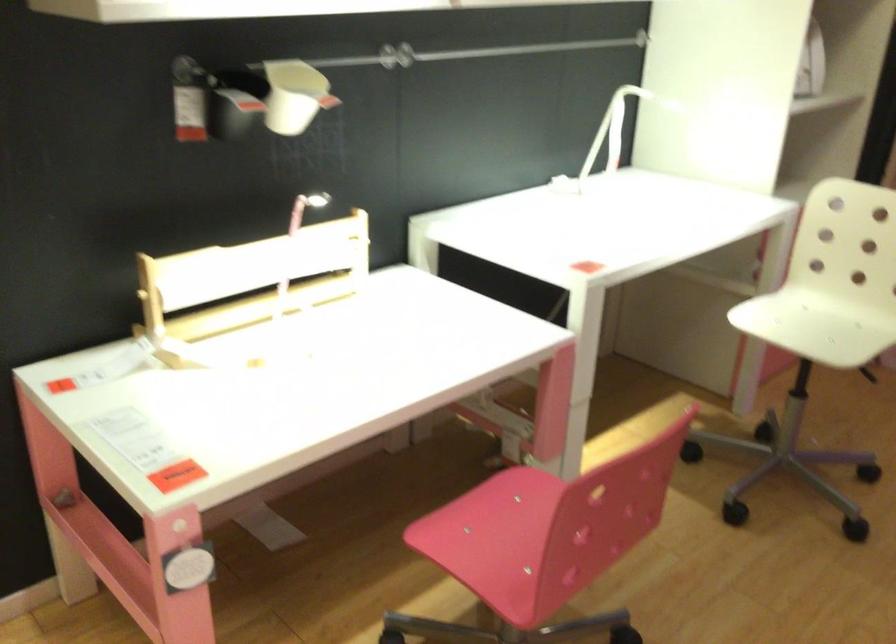
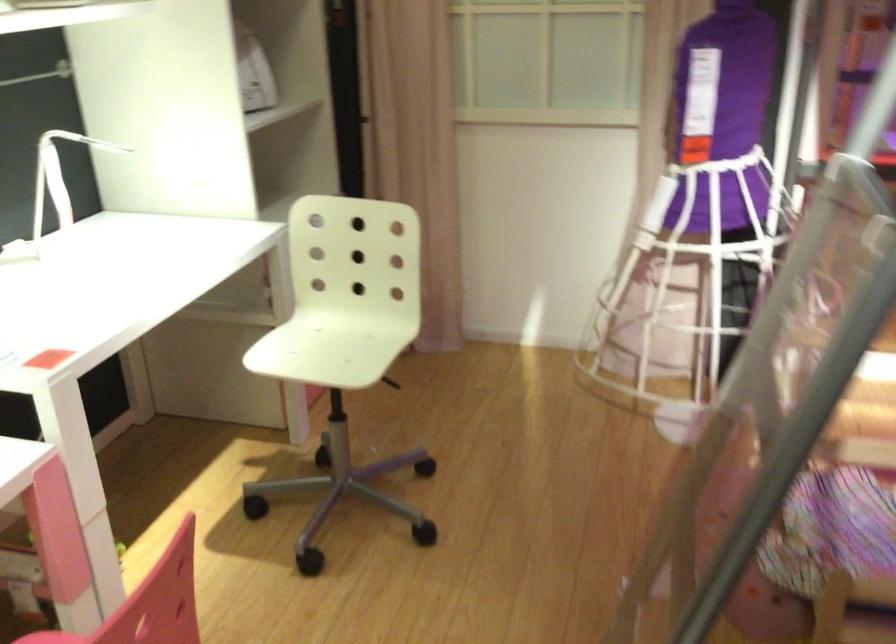
In the second image, find the point that corresponds to (604,128) in the first image.

(58, 176)